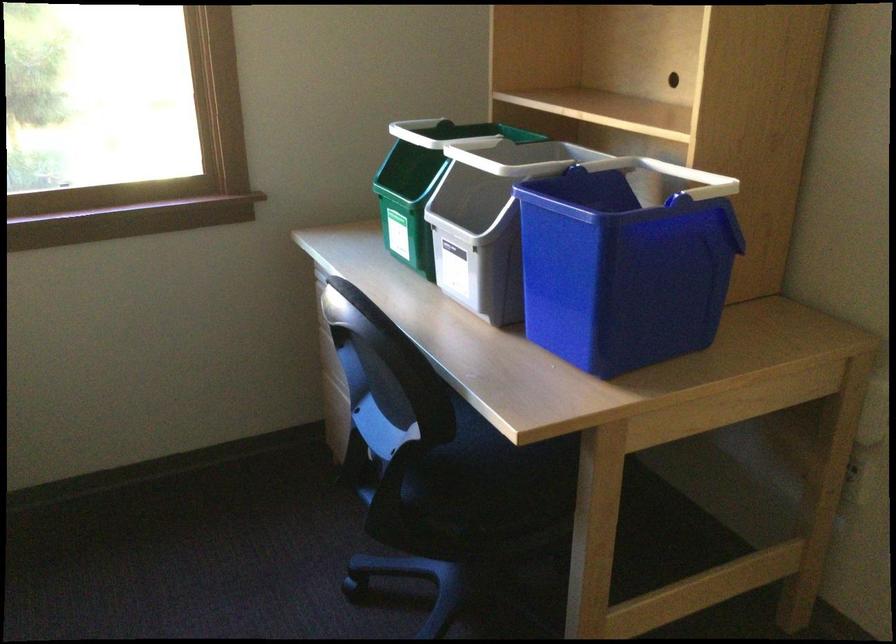
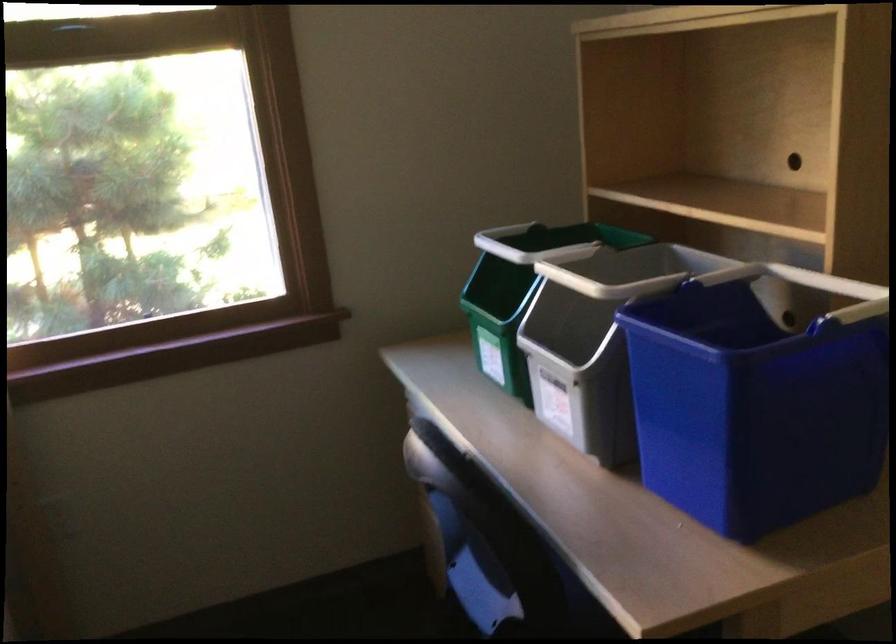
Question: The images are taken continuously from a first-person perspective. In which direction is your viewpoint rotating?

Choices:
 (A) Left
 (B) Right
 (C) Up
 (D) Down

Answer: (A)